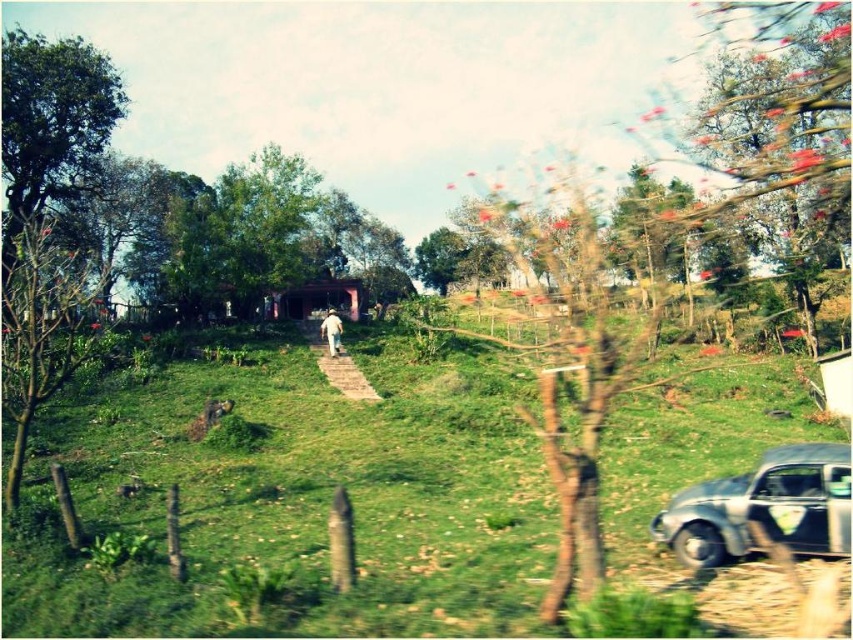
Question: Does green grassy at center appear over pink flowered tree at upper right?

Choices:
 (A) no
 (B) yes

Answer: (A)

Question: Does rusty metallic car at lower right appear over white cotton hat at center?

Choices:
 (A) yes
 (B) no

Answer: (B)

Question: From the image, what is the correct spatial relationship of pink flowered tree at upper right in relation to green leafy tree at center?

Choices:
 (A) above
 (B) below

Answer: (A)

Question: Among these points, which one is nearest to the camera?

Choices:
 (A) (320, 333)
 (B) (798, 496)

Answer: (B)

Question: Among these points, which one is farthest from the camera?

Choices:
 (A) [83, 58]
 (B) [328, 348]

Answer: (A)

Question: Which object is closer to the camera taking this photo?

Choices:
 (A) pink flowered tree at upper right
 (B) green grassy at center
 (C) rusty metallic car at lower right

Answer: (B)